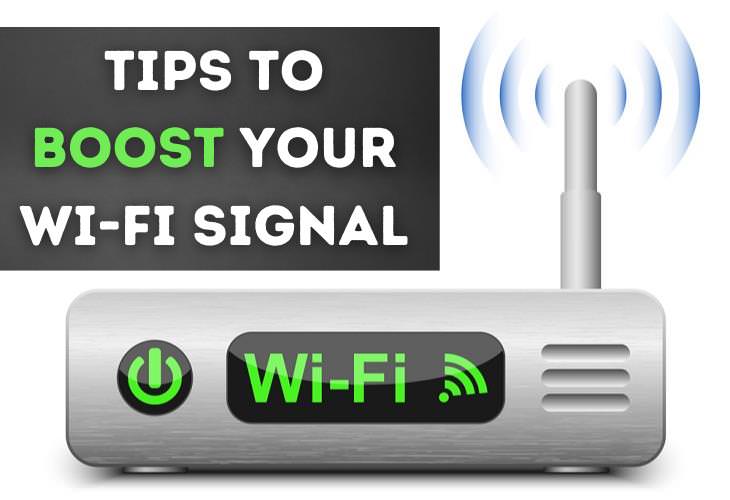
Find the location of `internet equipment`. internet equipment is located at coordinates (526, 310).